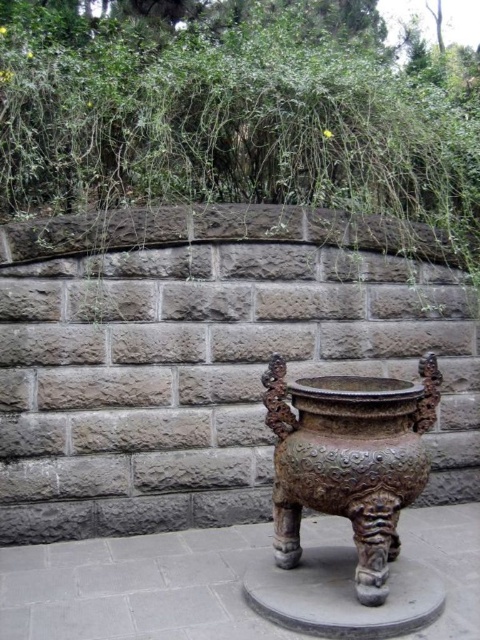
Between green leafy vegetation at upper center and bronze textured pot at center, which one is positioned higher?

green leafy vegetation at upper center

Is green leafy vegetation at upper center bigger than bronze textured pot at center?

Yes.

You are a GUI agent. You are given a task and a screenshot of the screen. Output one action in this format:
    pyautogui.click(x=<x>, y=<y>)
    Task: Click on the green leafy vegetation at upper center
    This screenshot has height=640, width=480.
    Given the screenshot: What is the action you would take?
    pyautogui.click(x=228, y=122)

Find the location of `green leafy vegetation at upper center`. green leafy vegetation at upper center is located at coordinates (228, 122).